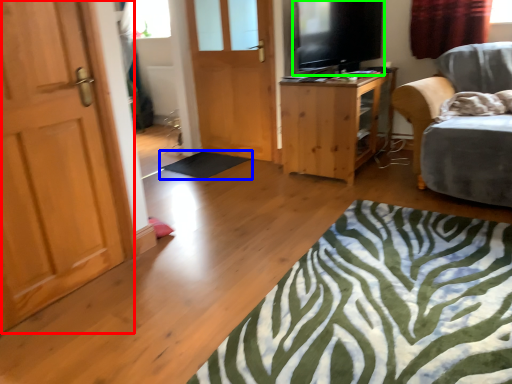
Question: Estimate the real-world distances between objects in this image. Which object is farther from door (highlighted by a red box), flat (highlighted by a blue box) or level (highlighted by a green box)?

Choices:
 (A) flat
 (B) level

Answer: (B)